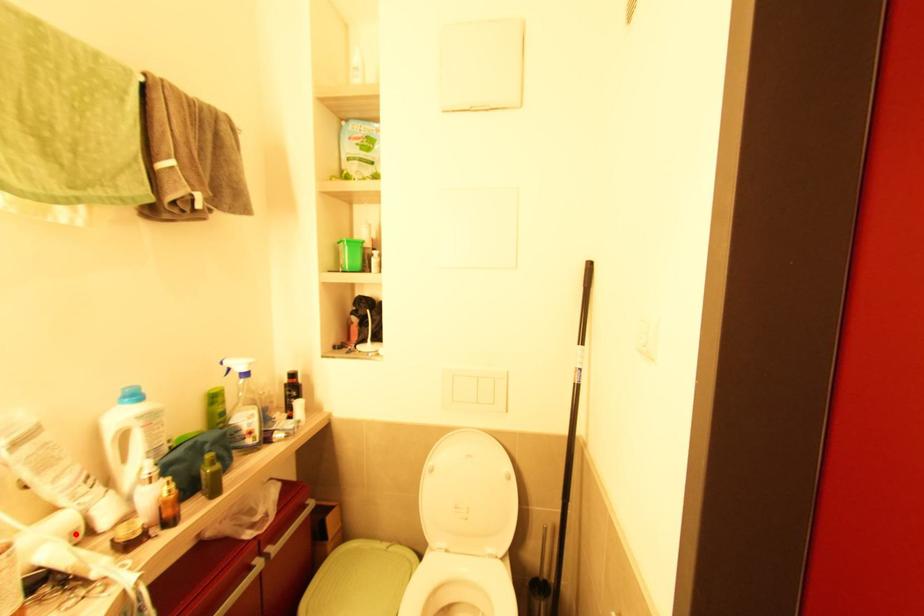
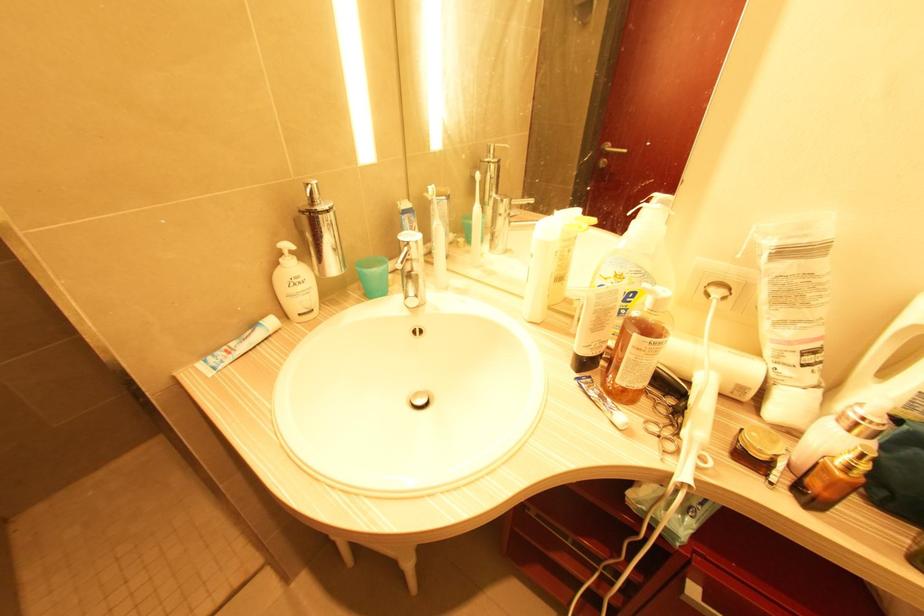
In the second image, find the point that corresponds to the highlighted location in the first image.

(743, 390)